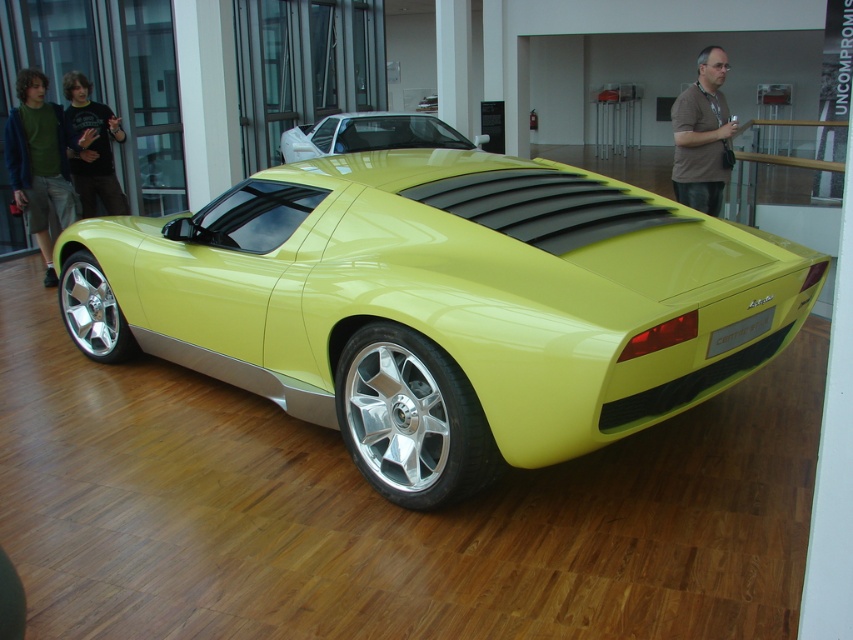
How much distance is there between lime glossy/sleek sports car at center and green cotton shirt at left?

lime glossy/sleek sports car at center is 3.77 meters away from green cotton shirt at left.

Does lime glossy/sleek sports car at center have a lesser height compared to green cotton shirt at left?

Correct, lime glossy/sleek sports car at center is not as tall as green cotton shirt at left.

Does point (373, 243) come in front of point (68, 145)?

Yes, point (373, 243) is in front of point (68, 145).

This screenshot has height=640, width=853. Identify the location of lime glossy/sleek sports car at center. (444, 305).

Is point (306, 342) more distant than point (326, 147)?

No, it is in front of (326, 147).

Is lime glossy/sleek sports car at center to the left of glossy yellow car at center from the viewer's perspective?

No, lime glossy/sleek sports car at center is not to the left of glossy yellow car at center.

Is point (480, 289) positioned behind point (433, 116)?

No, it is not.

Identify the location of lime glossy/sleek sports car at center. Image resolution: width=853 pixels, height=640 pixels. (444, 305).

Between glossy yellow car at center and matte black t-shirt at left, which one is positioned lower?

Positioned lower is matte black t-shirt at left.

Between point (416, 138) and point (109, 173), which one is positioned in front?

Positioned in front is point (109, 173).

Where is `glossy yellow car at center`? glossy yellow car at center is located at coordinates (370, 134).